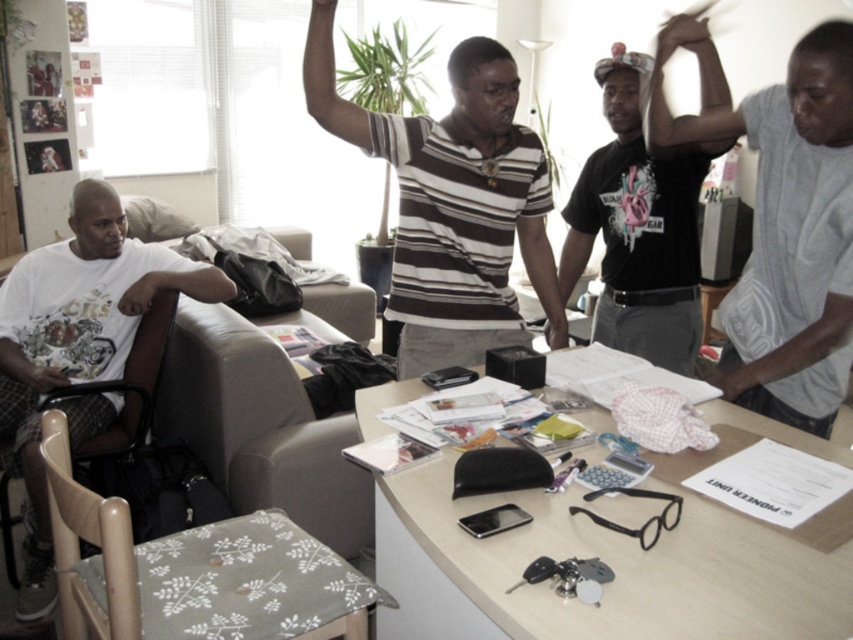
Is gray cotton shirt at right positioned behind matte black hand at upper right?

No.

Locate an element on the screen. The image size is (853, 640). gray cotton shirt at right is located at coordinates (791, 227).

Does point (410, 348) come behind point (776, 102)?

Yes, point (410, 348) is behind point (776, 102).

Does striped cotton shirt at center appear on the right side of gray cotton shirt at right?

In fact, striped cotton shirt at center is to the left of gray cotton shirt at right.

Is point (323, 16) positioned after point (822, 204)?

Yes.

At what (x,y) coordinates should I click in order to perform the action: click on striped cotton shirt at center. Please return your answer as a coordinate pair (x, y). The image size is (853, 640). Looking at the image, I should click on (451, 204).

Can you confirm if striped cotton shirt at center is positioned to the left of beige fabric armchair at center?

Incorrect, striped cotton shirt at center is not on the left side of beige fabric armchair at center.

This screenshot has width=853, height=640. What do you see at coordinates (451, 204) in the screenshot?
I see `striped cotton shirt at center` at bounding box center [451, 204].

This screenshot has width=853, height=640. Find the location of `striped cotton shirt at center`. striped cotton shirt at center is located at coordinates (451, 204).

Locate an element on the screen. The image size is (853, 640). striped cotton shirt at center is located at coordinates (451, 204).